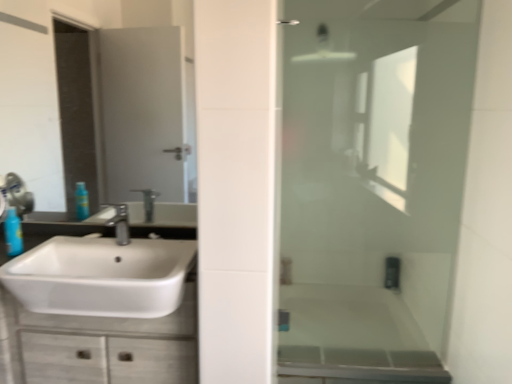
Question: Choose the correct answer: Is white glossy cabinet at lower left inside translucent plastic bottle at left or outside it?

Choices:
 (A) inside
 (B) outside

Answer: (B)

Question: Is white glossy cabinet at lower left in front of or behind translucent plastic bottle at left in the image?

Choices:
 (A) front
 (B) behind

Answer: (A)

Question: Which object is the farthest from the clear glass mirror at upper left?

Choices:
 (A) translucent plastic bottle at left
 (B) transparent glass shower door at right
 (C) satin nickel faucet at center
 (D) white glossy cabinet at lower left
 (E) white glossy sink at left

Answer: (B)

Question: Estimate the real-world distances between objects in this image. Which object is closer to the clear glass mirror at upper left?

Choices:
 (A) white glossy cabinet at lower left
 (B) transparent glass shower door at right
 (C) satin nickel faucet at center
 (D) translucent plastic bottle at left
 (E) white glossy sink at left

Answer: (E)